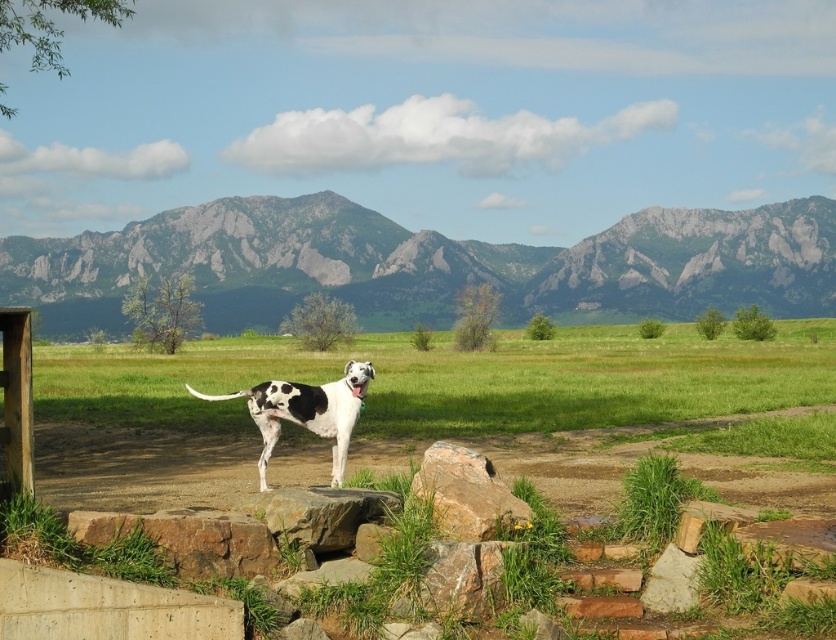
You are a hiker who wants to place a small marker exactly at the point marked by the coordinates in the image. The marker has a base diameter of 10 cm. Is there enough space at the point marked by point (187, 538) to place the marker without it being on any rocks or the dog?

The point (187, 538) is marked as brown rough stone at lower center. Since the marker requires a flat surface free of rocks and the dog, and the location is on a brown rough stone, there is insufficient space to place the marker safely.

You are a hiker who wants to place a small backpack on the ground between the brown rough stone at lower center and the smooth gray rock at center. Based on their positions, can you tell me which rock you should place the backpack closer to in order to avoid it rolling downhill?

The brown rough stone at lower center is positioned over smooth gray rock at center, so placing the backpack closer to the smooth gray rock at center would prevent it from rolling downhill since the lower position is more stable.

You are a hiker who wants to step over the brown rough rock at center. You notice there is a brown rough stone at lower center nearby. Which object is closer to your current position if you are standing on the path where the dog is?

The brown rough stone at lower center is closer to your current position because it is positioned on the left side of the brown rough rock at center, meaning it is nearer to the path where the dog is standing.